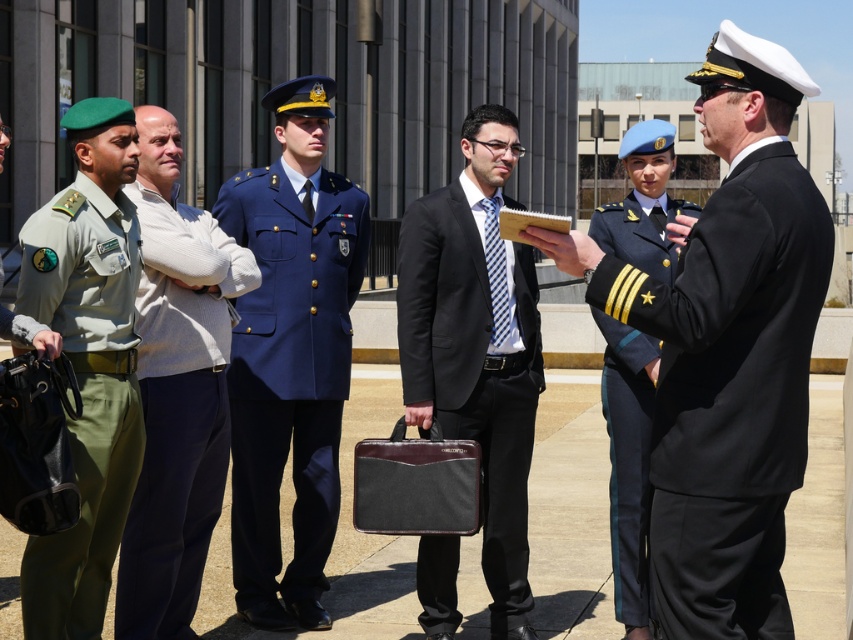
This screenshot has width=853, height=640. What do you see at coordinates (289, 371) in the screenshot?
I see `navy blue fabric uniform at center` at bounding box center [289, 371].

Locate an element on the screen. navy blue fabric uniform at center is located at coordinates (289, 371).

This screenshot has height=640, width=853. Identify the location of navy blue fabric uniform at center. (289, 371).

Between green fabric uniform at left and shiny blue uniform at center, which one appears on the left side from the viewer's perspective?

green fabric uniform at left is more to the left.

Find the location of `green fabric uniform at left`. green fabric uniform at left is located at coordinates (85, 394).

This screenshot has width=853, height=640. What do you see at coordinates (85, 394) in the screenshot? I see `green fabric uniform at left` at bounding box center [85, 394].

You are a GUI agent. You are given a task and a screenshot of the screen. Output one action in this format:
    pyautogui.click(x=<x>, y=<y>)
    Task: Click on the green fabric uniform at left
    The image size is (853, 640).
    Given the screenshot: What is the action you would take?
    pyautogui.click(x=85, y=394)

What do you see at coordinates (729, 392) in the screenshot? Image resolution: width=853 pixels, height=640 pixels. I see `navy blue fabric uniform at right` at bounding box center [729, 392].

Is navy blue fabric uniform at right positioned behind navy blue fabric uniform at center?

No, it is not.

Is point (703, 476) less distant than point (265, 369)?

Yes, point (703, 476) is closer to viewer.

Image resolution: width=853 pixels, height=640 pixels. Find the location of `navy blue fabric uniform at right`. navy blue fabric uniform at right is located at coordinates (729, 392).